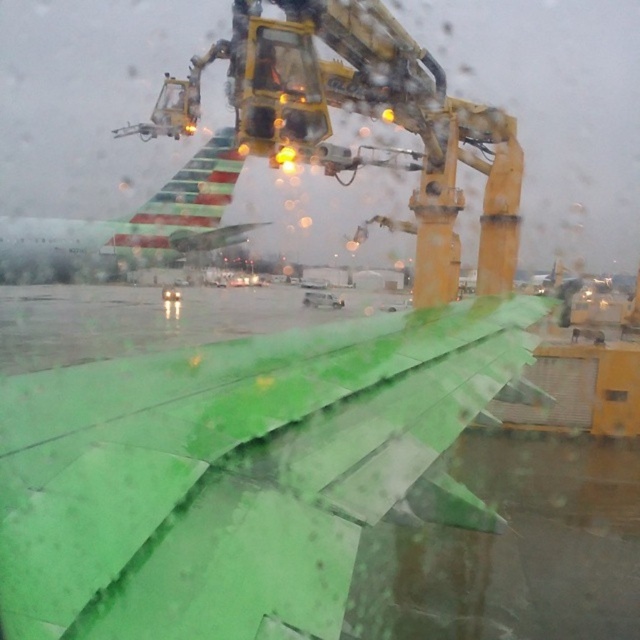
Question: Is green matte wing at lower left thinner than green matte airplane wing at upper left?

Choices:
 (A) no
 (B) yes

Answer: (B)

Question: Which point is closer to the camera?

Choices:
 (A) green matte airplane wing at upper left
 (B) yellow metallic crane at upper center
 (C) green matte wing at lower left

Answer: (C)

Question: Which of the following is the closest to the observer?

Choices:
 (A) (212, 632)
 (B) (221, 164)

Answer: (A)

Question: Which point is closer to the camera?

Choices:
 (A) (131, 227)
 (B) (452, 362)

Answer: (B)

Question: Is green matte wing at lower left smaller than yellow metallic crane at upper center?

Choices:
 (A) no
 (B) yes

Answer: (B)

Question: Does green matte wing at lower left appear under yellow metallic crane at upper center?

Choices:
 (A) no
 (B) yes

Answer: (B)